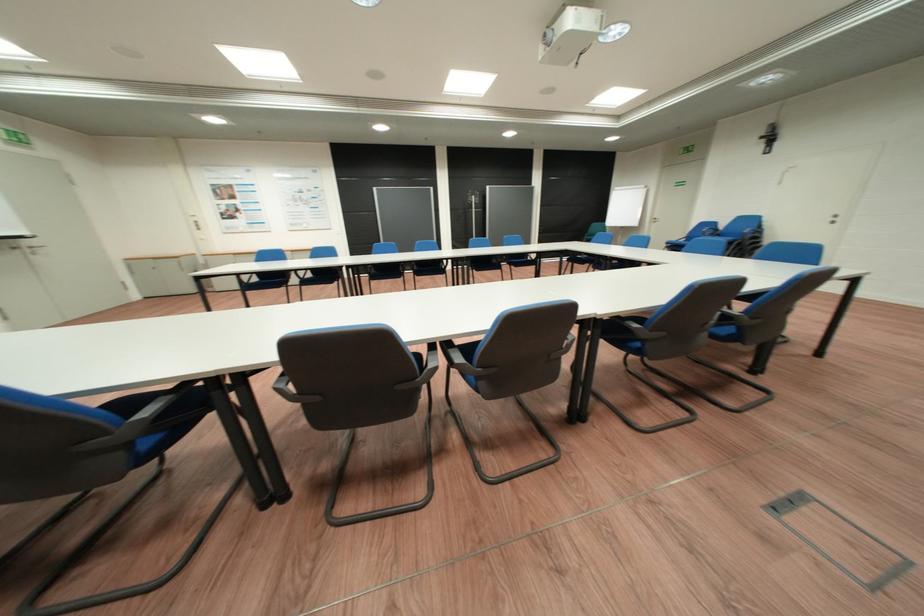
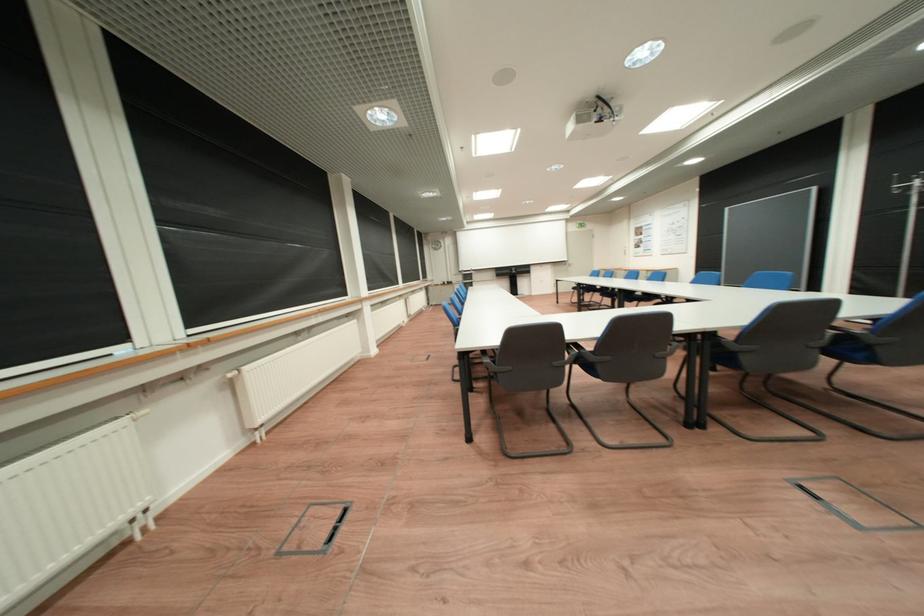
Question: I am providing you with two images of the same scene from different viewpoints. After the viewpoint changes to image2, which objects are now occluded?

Choices:
 (A) brown hardcover book
 (B) black chair armrest
 (C) floor box handle
 (D) blue chair armrest

Answer: (B)